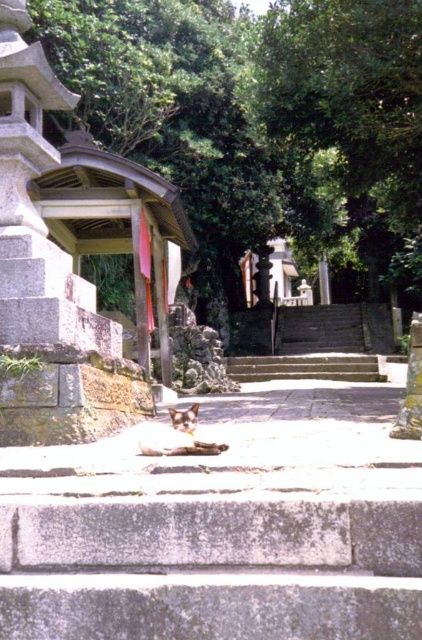
Question: Does smooth concrete stairs at center appear on the right side of gray concrete stairs at center?

Choices:
 (A) no
 (B) yes

Answer: (B)

Question: Among these points, which one is farthest from the camera?

Choices:
 (A) (308, 337)
 (B) (375, 371)

Answer: (A)

Question: Can you confirm if smooth concrete stairs at center is positioned below gray concrete stairs at center?

Choices:
 (A) no
 (B) yes

Answer: (A)

Question: Is smooth concrete stairs at center thinner than gray concrete stairs at center?

Choices:
 (A) yes
 (B) no

Answer: (B)

Question: Which object appears farthest from the camera in this image?

Choices:
 (A) smooth concrete stairs at center
 (B) gray concrete stairs at center

Answer: (A)